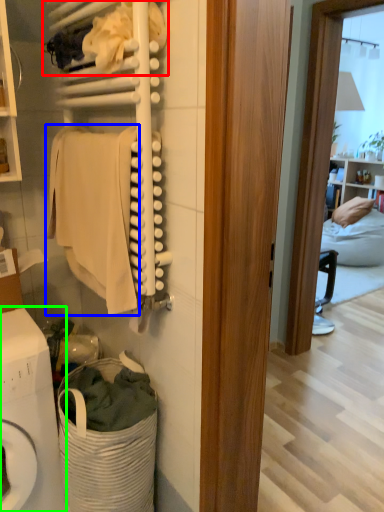
Question: Which is nearer to the laundry (highlighted by a red box)? clothing (highlighted by a blue box) or washing machine (highlighted by a green box).

Choices:
 (A) clothing
 (B) washing machine

Answer: (A)